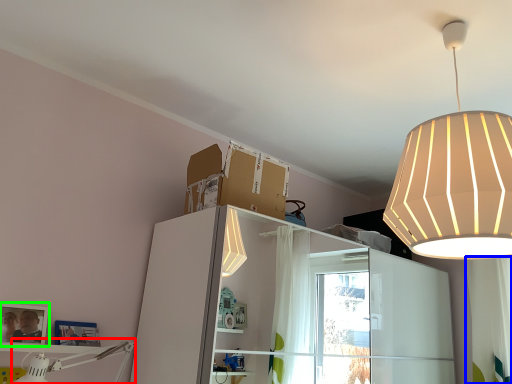
Question: Which is nearer to the lamp (highlighted by a red box)? curtain (highlighted by a blue box) or picture frame (highlighted by a green box).

Choices:
 (A) curtain
 (B) picture frame

Answer: (B)